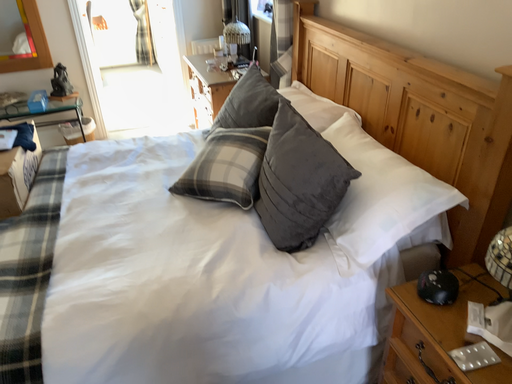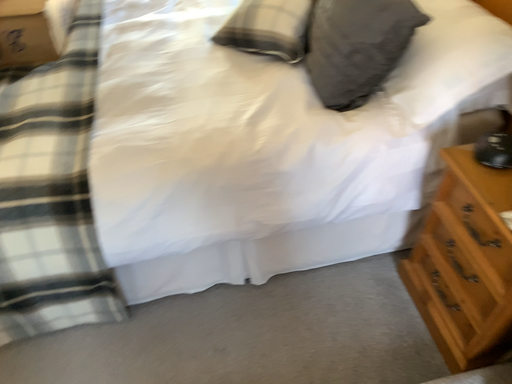
Question: Which way did the camera rotate in the video?

Choices:
 (A) rotated downward
 (B) rotated upward

Answer: (A)